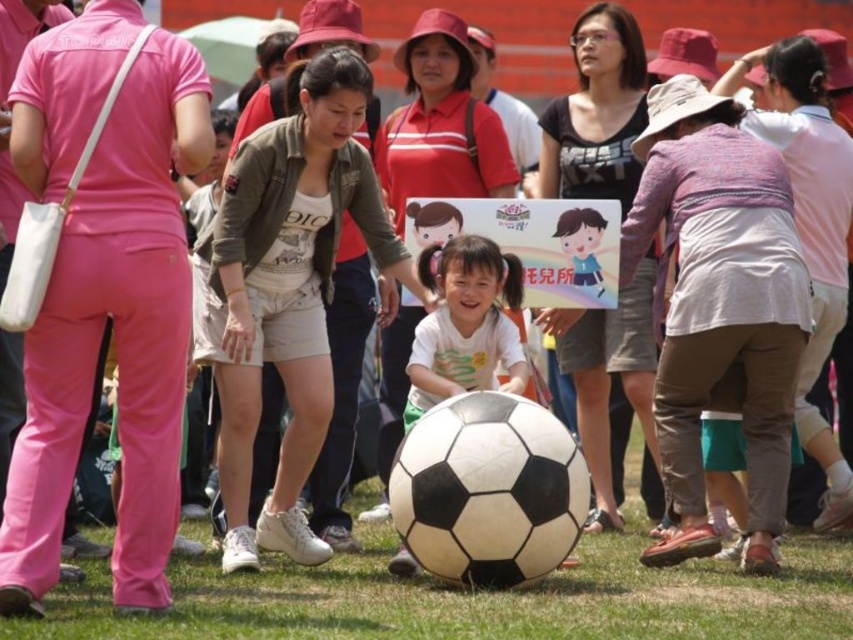
Is point (317, 625) less distant than point (416, 381)?

Yes, it is.

Is green grass at center in front of white matte soccer ball at center?

Yes, green grass at center is in front of white matte soccer ball at center.

Locate an element on the screen. This screenshot has height=640, width=853. green grass at center is located at coordinates (477, 598).

This screenshot has height=640, width=853. Find the location of `green grass at center`. green grass at center is located at coordinates (477, 598).

Does green grass at center come in front of matte white shirt at center?

Yes, green grass at center is closer to the viewer.

Who is taller, green grass at center or matte white shirt at center?

With more height is matte white shirt at center.

Between point (294, 634) and point (403, 326), which one is positioned behind?

Point (403, 326)

What are the coordinates of `green grass at center` in the screenshot? It's located at (477, 598).

Who is more forward, (288, 122) or (587, 193)?

Positioned in front is point (288, 122).

Consider the image. Is matte green jacket at center closer to camera compared to matte black shirt at center?

Yes.

Describe the element at coordinates (289, 291) in the screenshot. I see `matte green jacket at center` at that location.

In order to click on matte green jacket at center in this screenshot , I will do `click(289, 291)`.